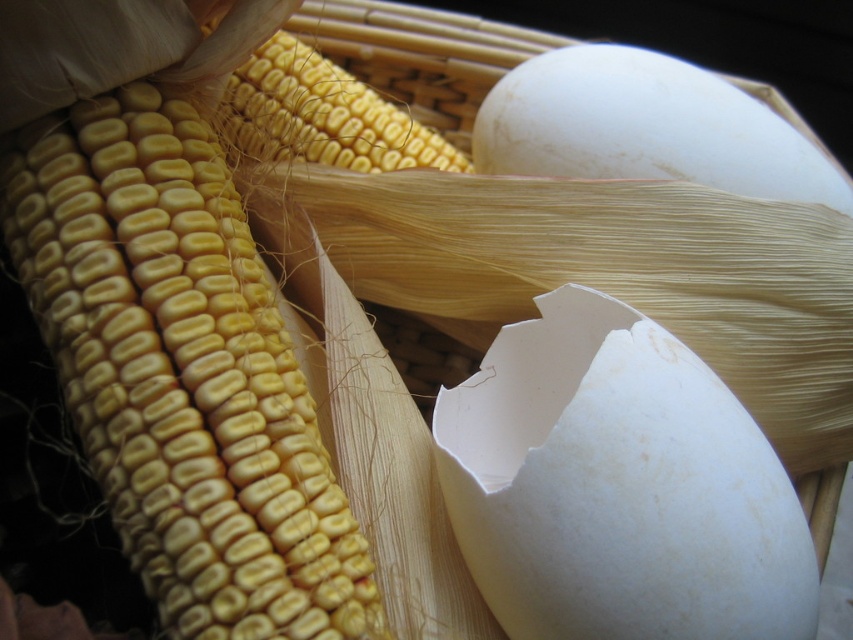
Who is positioned more to the left, white smooth egg at center or white smooth egg at upper right?

white smooth egg at center

Who is more forward, (583, 355) or (590, 168)?

Point (583, 355) is in front.

Find the location of a particular element. white smooth egg at center is located at coordinates (618, 486).

Who is higher up, yellow matte corn at left or white smooth egg at center?

Positioned higher is yellow matte corn at left.

Find the location of a particular element. Image resolution: width=853 pixels, height=640 pixels. yellow matte corn at left is located at coordinates (183, 376).

Who is higher up, yellow matte corn at left or white smooth egg at upper right?

white smooth egg at upper right is higher up.

Who is positioned more to the right, yellow matte corn at left or white smooth egg at upper right?

white smooth egg at upper right is more to the right.

This screenshot has height=640, width=853. What are the coordinates of `yellow matte corn at left` in the screenshot? It's located at (183, 376).

This screenshot has width=853, height=640. Identify the location of yellow matte corn at left. (183, 376).